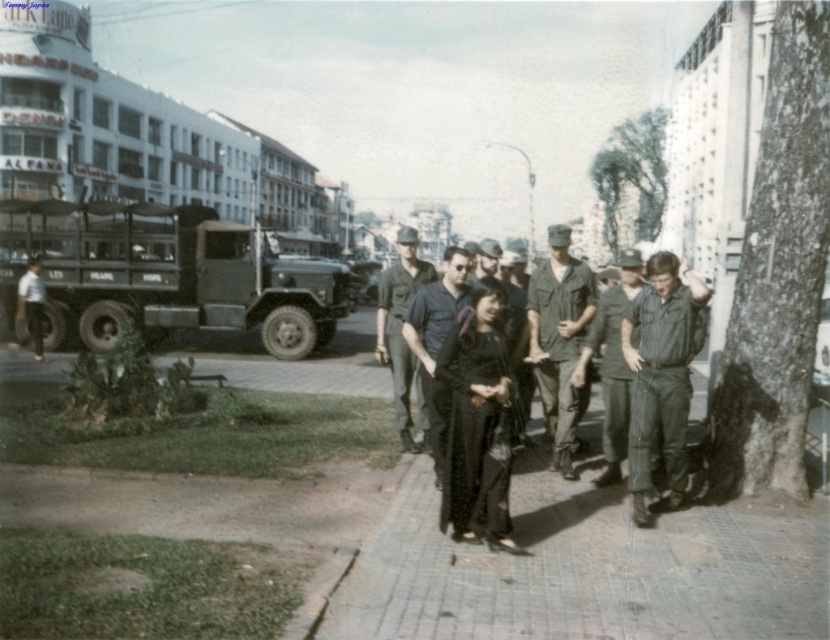
Question: Considering the real-world distances, which object is farthest from the black matte shirt at center?

Choices:
 (A) black matte dress at center
 (B) green fabric uniform at right
 (C) matte green uniform at left
 (D) camouflage fabric uniform at center

Answer: (C)

Question: Does black matte dress at center have a larger size compared to green fabric uniform at right?

Choices:
 (A) yes
 (B) no

Answer: (B)

Question: Does camouflage fabric uniform at center appear on the right side of black matte shirt at center?

Choices:
 (A) yes
 (B) no

Answer: (A)

Question: Which object is farther from the camera taking this photo?

Choices:
 (A) green fabric uniform at right
 (B) black matte shirt at center
 (C) green fabric uniform at center

Answer: (C)

Question: Is black matte shirt at center to the right of green fabric uniform at center from the viewer's perspective?

Choices:
 (A) no
 (B) yes

Answer: (A)

Question: Among these points, which one is nearest to the camera?

Choices:
 (A) (403, 262)
 (B) (20, 276)
 (C) (491, 394)

Answer: (C)